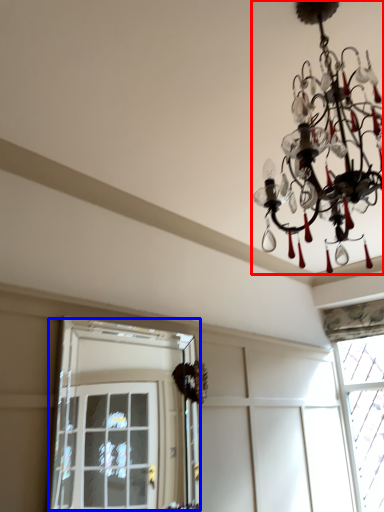
Question: Among these objects, which one is nearest to the camera, lamp (highlighted by a red box) or window (highlighted by a blue box)?

Choices:
 (A) lamp
 (B) window

Answer: (A)